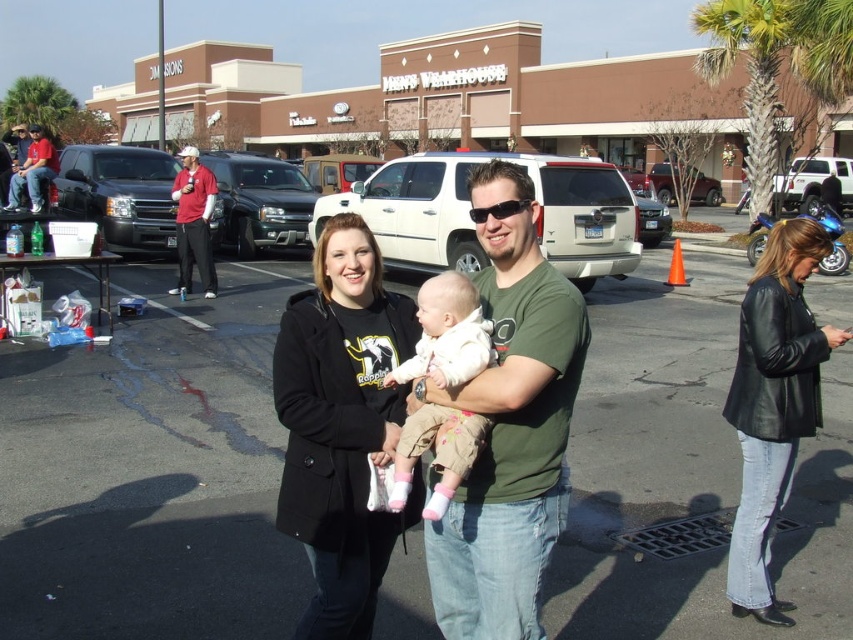
Between black leather jacket at lower right and silver metallic suv at center, which one appears on the left side from the viewer's perspective?

From the viewer's perspective, black leather jacket at lower right appears more on the left side.

Who is lower down, black leather jacket at lower right or silver metallic suv at center?

black leather jacket at lower right is lower down.

Is point (747, 387) less distant than point (642, 234)?

That is True.

Image resolution: width=853 pixels, height=640 pixels. I want to click on black leather jacket at lower right, so click(x=773, y=403).

Between matte black truck at center and white matte suv at upper right, which one is positioned lower?

matte black truck at center

Does point (296, 195) lie behind point (793, 170)?

No, it is not.

Does point (296, 179) come closer to viewer compared to point (819, 157)?

That is True.

The image size is (853, 640). What are the coordinates of `matte black truck at center` in the screenshot? It's located at (258, 202).

Between black leather jacket at lower right and white fleece baby at center, which one appears on the left side from the viewer's perspective?

Positioned to the left is white fleece baby at center.

Is point (828, 248) closer to viewer compared to point (442, 342)?

No, (828, 248) is further to viewer.

Which is behind, point (747, 397) or point (463, 449)?

Point (747, 397)

This screenshot has height=640, width=853. In order to click on black leather jacket at lower right in this screenshot , I will do `click(773, 403)`.